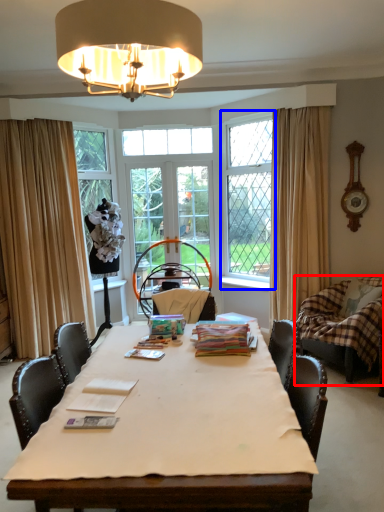
Question: Which object is closer to the camera taking this photo, swivel chair (highlighted by a red box) or window (highlighted by a blue box)?

Choices:
 (A) swivel chair
 (B) window

Answer: (A)